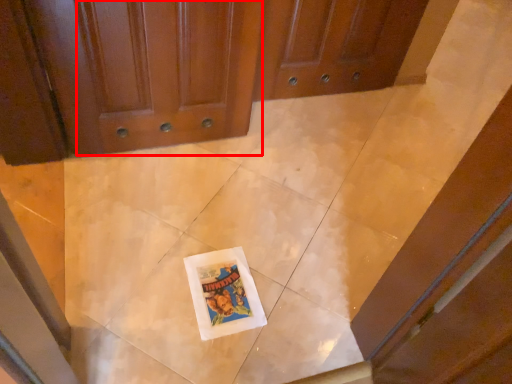
Question: From the image's perspective, what is the correct spatial positioning of door (annotated by the red box) in reference to comic book?

Choices:
 (A) below
 (B) above

Answer: (B)